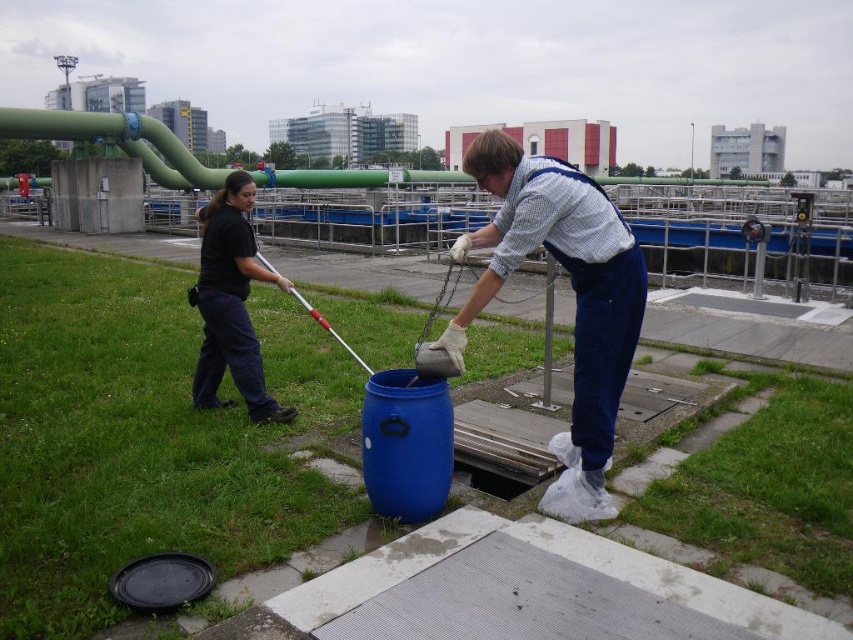
Question: Among these objects, which one is farthest from the camera?

Choices:
 (A) black fabric pants at left
 (B) blue denim overalls at center

Answer: (A)

Question: Which point is closer to the camera?

Choices:
 (A) black fabric pants at left
 (B) blue denim overalls at center

Answer: (B)

Question: Does blue denim overalls at center have a larger size compared to black fabric pants at left?

Choices:
 (A) no
 (B) yes

Answer: (A)

Question: Which object appears closest to the camera in this image?

Choices:
 (A) black fabric pants at left
 (B) blue denim overalls at center

Answer: (B)

Question: Is blue denim overalls at center thinner than black fabric pants at left?

Choices:
 (A) yes
 (B) no

Answer: (A)

Question: Is blue denim overalls at center smaller than black fabric pants at left?

Choices:
 (A) yes
 (B) no

Answer: (A)